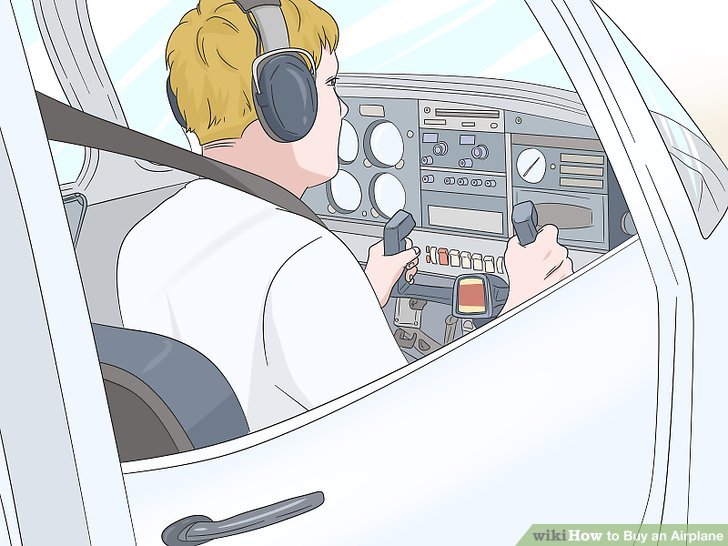
Locate an element on the screen. This screenshot has width=728, height=546. control panel is located at coordinates (470, 161).